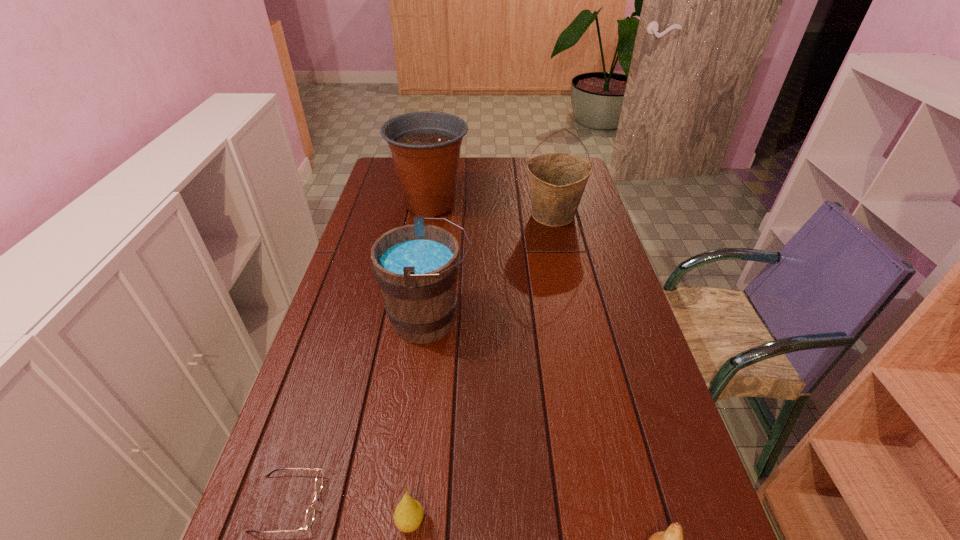
Identify the location of vacant space that's between the left pear and the shortest object. This screenshot has height=540, width=960. (349, 513).

The width and height of the screenshot is (960, 540). Find the location of `vacant area between the flowerpot and the spectacles`. vacant area between the flowerpot and the spectacles is located at coordinates (359, 354).

Identify the location of free space between the shorter wine bucket and the shortest object. (358, 412).

Locate an element on the screen. This screenshot has width=960, height=540. empty space that is in between the farther pear and the shortest object is located at coordinates (349, 513).

Identify which object is the second nearest to the nearest object. Please provide its 2D coordinates. Your answer should be formatted as a tuple, i.e. [(x, y)], where the tuple contains the x and y coordinates of a point satisfying the conditions above.

[(416, 266)]

Where is `the third closest object to the spectacles`? The height and width of the screenshot is (540, 960). the third closest object to the spectacles is located at coordinates (672, 539).

At what (x,y) coordinates should I click in order to perform the action: click on free space that satisfies the following two spatial constraints: 1. on the front side of the flowerpot; 2. on the lenses of the spectacles. Please return your answer as a coordinate pair (x, y). The height and width of the screenshot is (540, 960). Looking at the image, I should click on (383, 503).